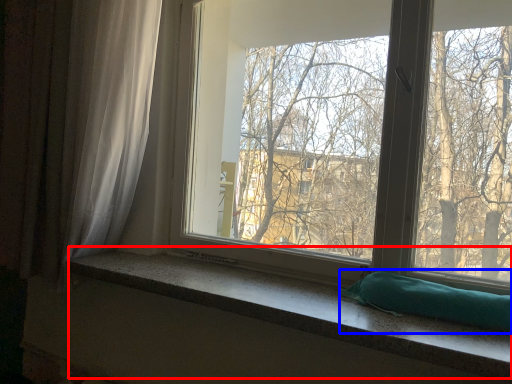
Question: Which point is closer to the camera, window sill (highlighted by a red box) or pillow (highlighted by a blue box)?

Choices:
 (A) window sill
 (B) pillow

Answer: (A)